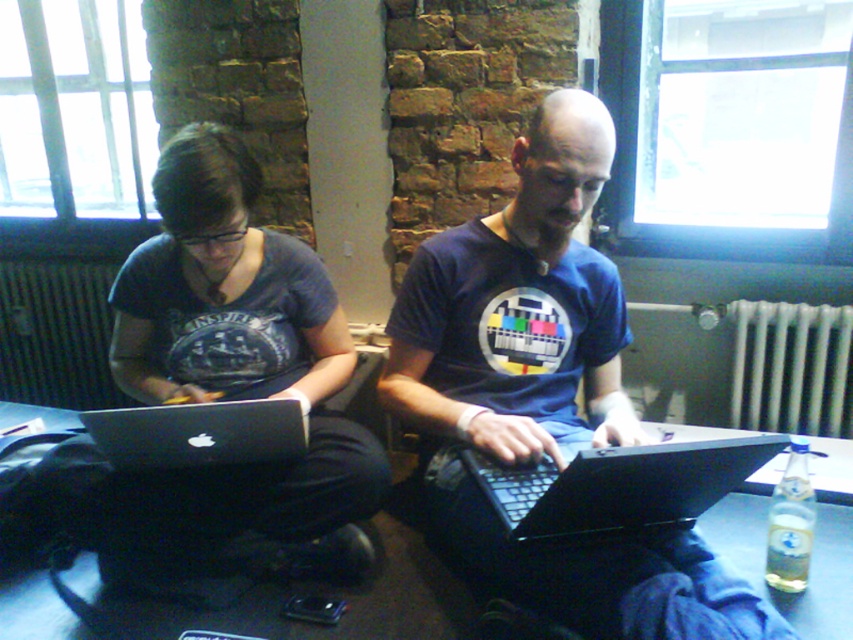
How distant is black plastic table at center from white metallic radiator at right?

The distance of black plastic table at center from white metallic radiator at right is 1.16 meters.

Does point (25, 612) lie behind point (819, 428)?

No, (25, 612) is in front of (819, 428).

Between point (374, 584) and point (769, 394), which one is positioned behind?

The point (769, 394) is more distant.

Where is `black plastic table at center`? The image size is (853, 640). black plastic table at center is located at coordinates (309, 624).

Can you confirm if black plastic laptop at center is smaller than white metallic radiator at right?

Yes, black plastic laptop at center is smaller than white metallic radiator at right.

Does black plastic laptop at center appear on the right side of white metallic radiator at right?

Incorrect, black plastic laptop at center is not on the right side of white metallic radiator at right.

Is point (619, 472) positioned behind point (842, 355)?

No, it is not.

You are a GUI agent. You are given a task and a screenshot of the screen. Output one action in this format:
    pyautogui.click(x=<x>, y=<y>)
    Task: Click on the black plastic laptop at center
    
    Given the screenshot: What is the action you would take?
    pyautogui.click(x=618, y=486)

Image resolution: width=853 pixels, height=640 pixels. In order to click on matte black laptop at center in this screenshot , I will do point(519,308).

Does matte black laptop at center appear under silver metallic laptop at center?

No.

In order to click on matte black laptop at center in this screenshot , I will do click(x=519, y=308).